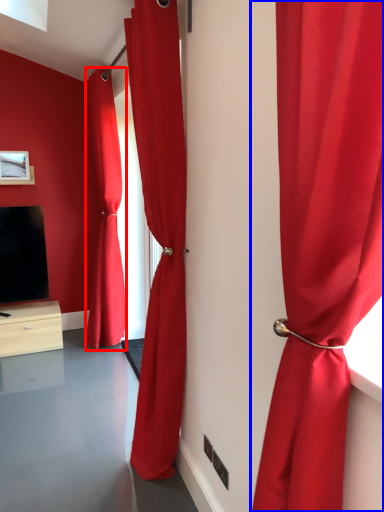
Question: Among these objects, which one is farthest to the camera, curtain (highlighted by a red box) or curtain (highlighted by a blue box)?

Choices:
 (A) curtain
 (B) curtain

Answer: (A)